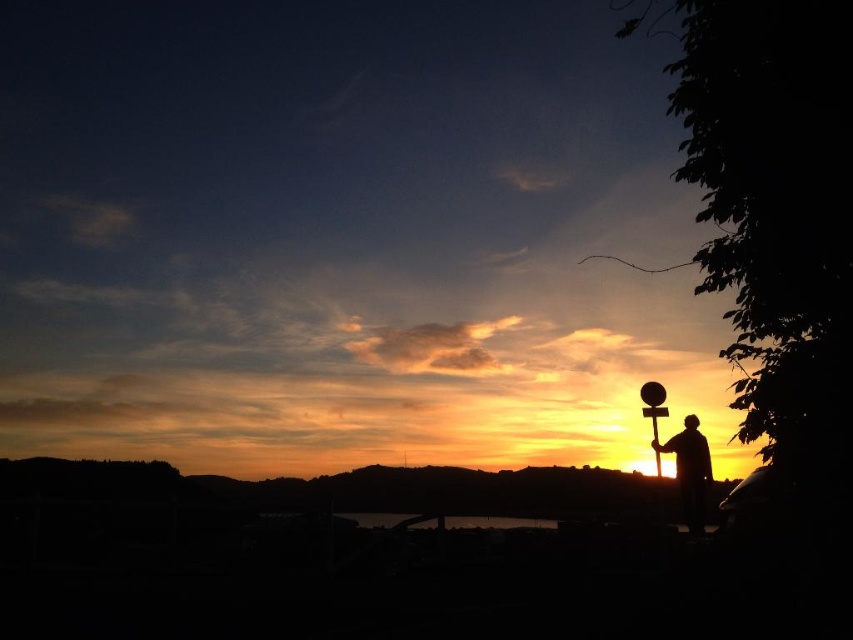
Question: Is silhouette figure at right wider than dark reflective water at center?

Choices:
 (A) yes
 (B) no

Answer: (B)

Question: Observing the image, what is the correct spatial positioning of silhouette figure at right in reference to dark reflective water at center?

Choices:
 (A) above
 (B) below

Answer: (A)

Question: Does silhouette figure at right appear on the left side of dark reflective water at center?

Choices:
 (A) no
 (B) yes

Answer: (A)